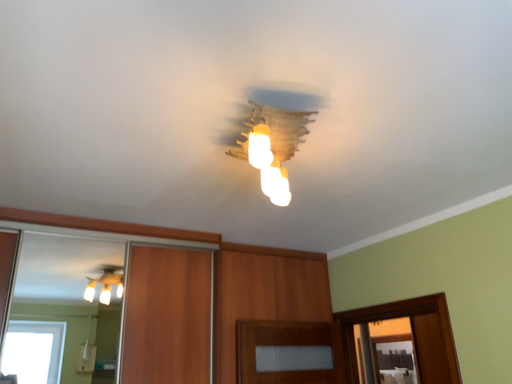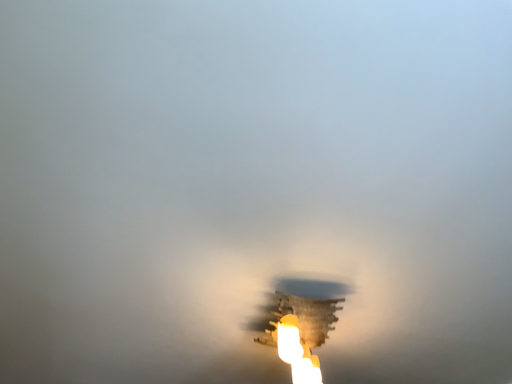
Question: Which way did the camera rotate in the video?

Choices:
 (A) rotated downward
 (B) rotated upward

Answer: (B)